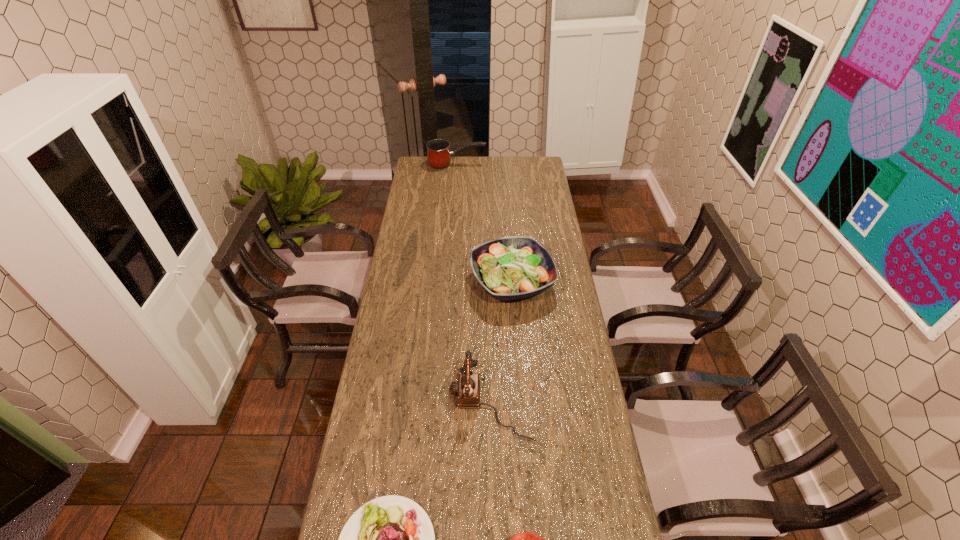
Identify the location of object at the left edge. The image size is (960, 540). (438, 154).

You are a GUI agent. You are given a task and a screenshot of the screen. Output one action in this format:
    pyautogui.click(x=<x>, y=<y>)
    Task: Click on the object that is at the right edge
    
    Given the screenshot: What is the action you would take?
    pyautogui.click(x=508, y=268)

Where is `object situated at the far left corner`? This screenshot has height=540, width=960. object situated at the far left corner is located at coordinates (438, 154).

This screenshot has height=540, width=960. In order to click on free spot at the far edge of the desktop in this screenshot , I will do `click(451, 156)`.

At what (x,y) coordinates should I click in order to perform the action: click on vacant space at the left edge. Please return your answer as a coordinate pair (x, y). Looking at the image, I should click on (440, 181).

In the image, there is a desktop. Where is `free region at the right edge`? The image size is (960, 540). free region at the right edge is located at coordinates (577, 435).

You are a GUI agent. You are given a task and a screenshot of the screen. Output one action in this format:
    pyautogui.click(x=<x>, y=<y>)
    Task: Click on the free spot at the far left corner of the desktop
    
    Given the screenshot: What is the action you would take?
    pyautogui.click(x=418, y=166)

Identify the location of vacant area that lies between the farthest object and the third nearest object. (474, 284).

You are a GUI agent. You are given a task and a screenshot of the screen. Output one action in this format:
    pyautogui.click(x=<x>, y=<y>)
    Task: Click on the free space between the farther salad plate and the saucepan
    Image resolution: width=960 pixels, height=540 pixels.
    Given the screenshot: What is the action you would take?
    485,224

Locate which object is the closest to the farthest object. Please provide its 2D coordinates. Your answer should be formatted as a tuple, i.e. [(x, y)], where the tuple contains the x and y coordinates of a point satisfying the conditions above.

[(508, 268)]